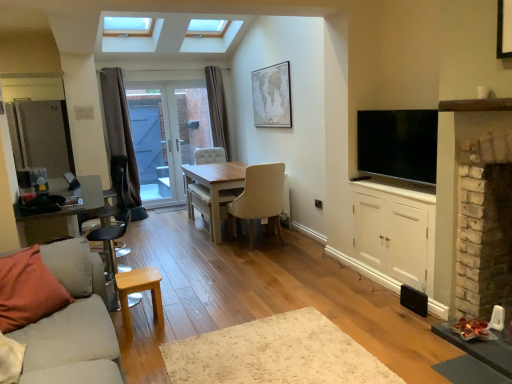
Question: In terms of width, does white wood cabinet at right look wider or thinner when compared to brown fabric curtain at left, which is the second curtain from right to left?

Choices:
 (A) thin
 (B) wide

Answer: (B)

Question: From the image's perspective, is white wood cabinet at right above or below brown fabric curtain at left, which is the second curtain from right to left?

Choices:
 (A) above
 (B) below

Answer: (B)

Question: Which is farther from the orange cotton pillow at lower left?

Choices:
 (A) beige fabric chair at center, the second chair positioned from the left
 (B) beige fabric couch at left
 (C) metallic silver barstool at left, which is counted as the 2th armchair, starting from the left
 (D) brown fabric curtain at left, which appears as the second curtain when viewed from the back
 (E) light beige fabric chair at center, the 2th chair from the right

Answer: (D)

Question: Estimate the real-world distances between objects in this image. Which object is closer to the beige fabric chair at center, the second chair positioned from the left?

Choices:
 (A) black leather armchair at left, the first armchair from the left
 (B) orange cotton pillow at lower left
 (C) brown velvet curtain at center, the first curtain positioned from the right
 (D) beige textured map at upper center
 (E) white wood cabinet at right

Answer: (D)